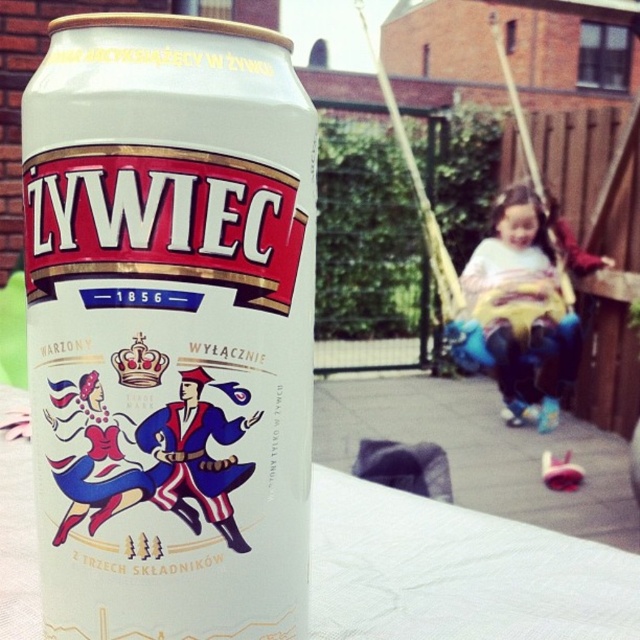
Does white matte beer can at center have a greater height compared to light blue denim jeans at lower right?

In fact, white matte beer can at center may be shorter than light blue denim jeans at lower right.

Does white matte beer can at center appear under light blue denim jeans at lower right?

Yes, white matte beer can at center is below light blue denim jeans at lower right.

Where is `white matte beer can at center`? The image size is (640, 640). white matte beer can at center is located at coordinates (170, 326).